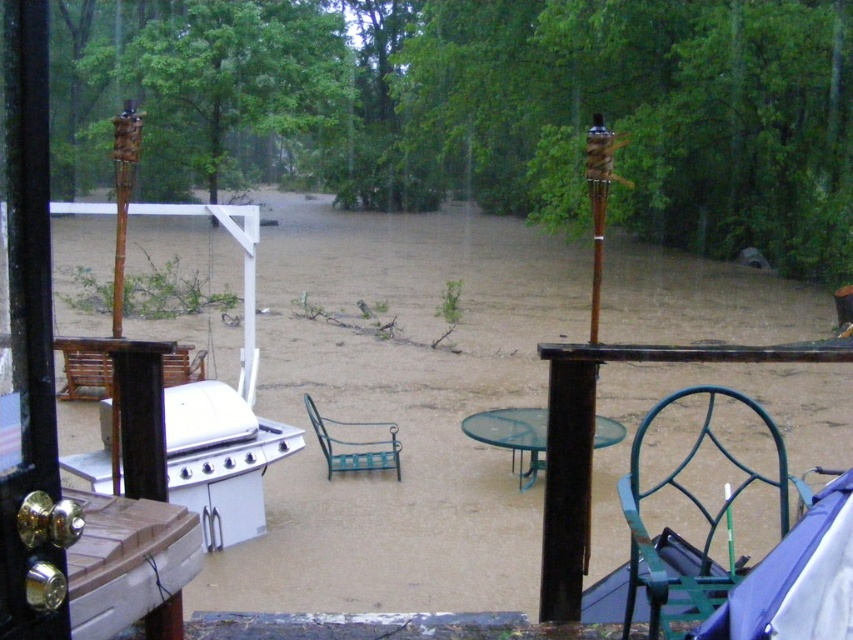
Question: Among these points, which one is nearest to the camera?

Choices:
 (A) (833, 563)
 (B) (332, 467)
 (C) (676, 474)

Answer: (A)

Question: Which point appears farthest from the camera in this image?

Choices:
 (A) (784, 451)
 (B) (175, 480)
 (C) (741, 634)

Answer: (B)

Question: Is the position of white glossy grill at lower left less distant than that of green wrought iron chair at center?

Choices:
 (A) yes
 (B) no

Answer: (A)

Question: Among these objects, which one is farthest from the camera?

Choices:
 (A) blue fabric umbrella at lower right
 (B) green wire chair at lower right
 (C) white glossy grill at lower left
 (D) green wrought iron chair at center

Answer: (D)

Question: Can you confirm if white glossy grill at lower left is smaller than green wire chair at lower right?

Choices:
 (A) no
 (B) yes

Answer: (B)

Question: Is blue fabric umbrella at lower right thinner than green wrought iron chair at center?

Choices:
 (A) yes
 (B) no

Answer: (A)